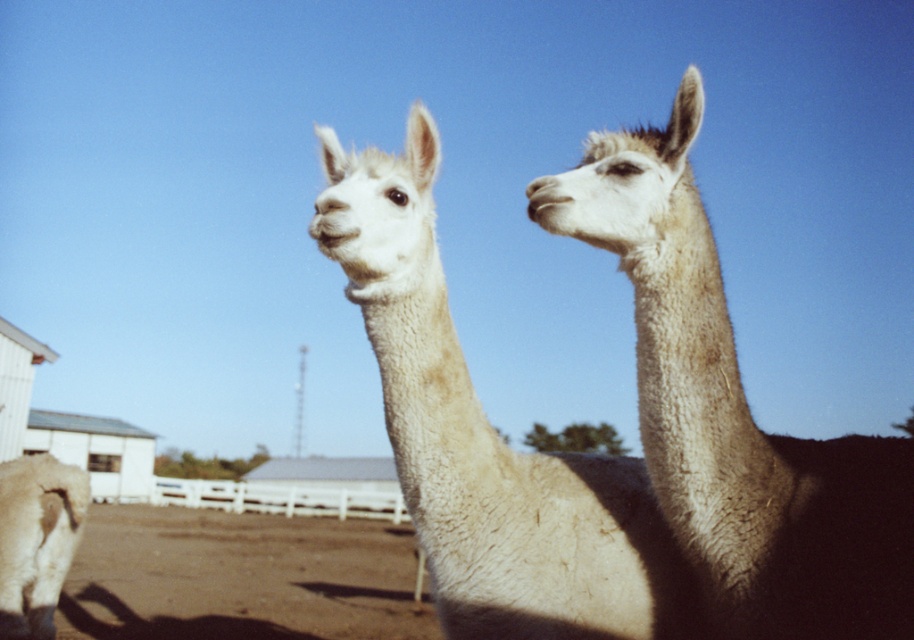
Consider the image. Based on the scene description, where is the white woolen alpaca at center located in terms of coordinates?

The white woolen alpaca at center is located at coordinates point (487, 440).

You are a photographer trying to capture both alpacas in a single frame. The white woolen alpaca at upper right is represented by point (732, 413). Where should you position yourself relative to the alpacas to ensure both are in the frame?

To capture both alpacas in the frame, position yourself so that the white woolen alpaca at upper right is at point (732, 413), ensuring the other alpaca is also within the camera view.

You are a farmer checking the size of your alpacas. You see the white woolen alpaca at upper right and the white woolen alpaca at center. Which one takes up more space in the image?

The white woolen alpaca at center takes up more space in the image than the white woolen alpaca at upper right because it occupies more space according to the description.